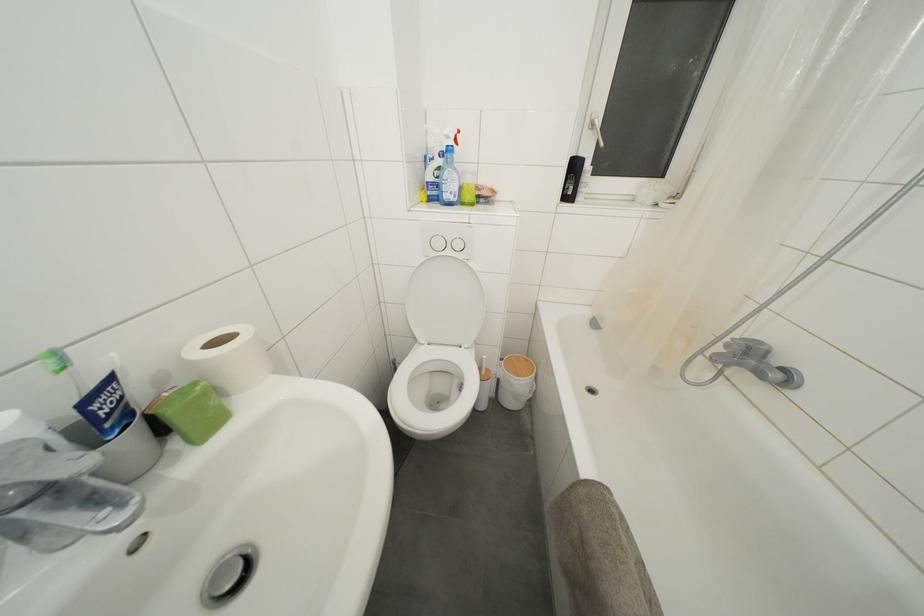
Locate an element on the screen. wooden trash can lid is located at coordinates (517, 368).